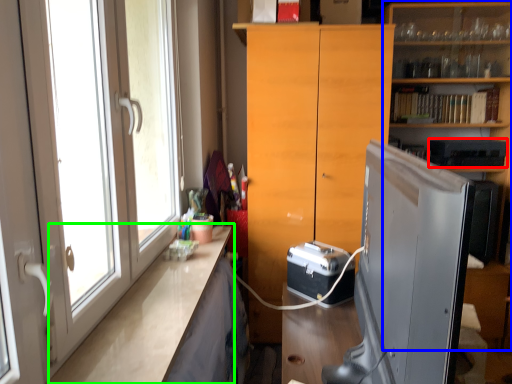
Question: Which object is the farthest from appliance (highlighted by a red box)? Choose among these: shelf (highlighted by a blue box) or counter top (highlighted by a green box).

Choices:
 (A) shelf
 (B) counter top

Answer: (B)